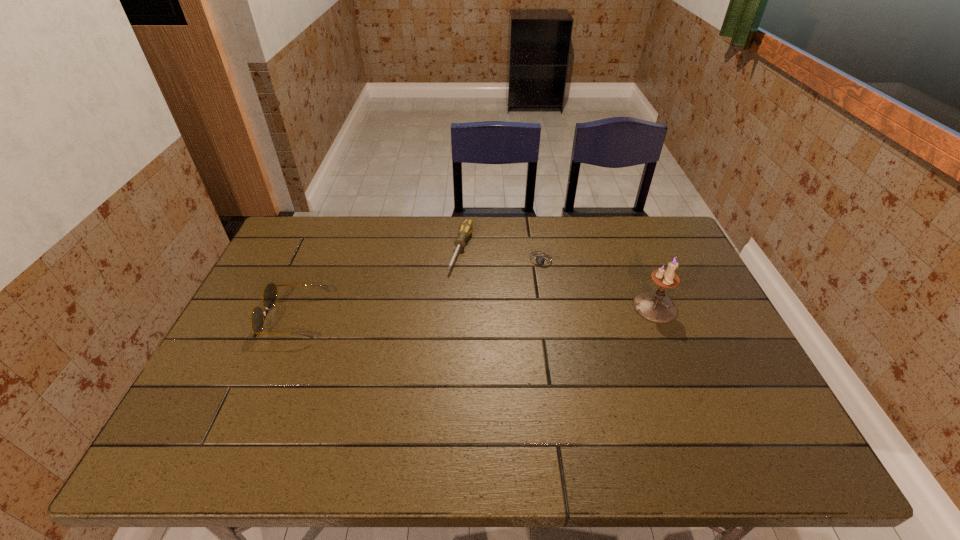
You are a GUI agent. You are given a task and a screenshot of the screen. Output one action in this format:
    pyautogui.click(x=<x>, y=<y>)
    Task: Click on the free space located 0.300m at the tip of the third object from right to left
    
    Given the screenshot: What is the action you would take?
    pyautogui.click(x=428, y=349)

This screenshot has width=960, height=540. Find the location of `vacant space situated 0.100m at the tip of the third object from right to left`. vacant space situated 0.100m at the tip of the third object from right to left is located at coordinates (449, 296).

Identify the location of vacant area situated 0.240m on the face of the shortest object. (503, 323).

Where is `vacant space located 0.330m on the face of the shortest object`? Image resolution: width=960 pixels, height=540 pixels. vacant space located 0.330m on the face of the shortest object is located at coordinates (489, 347).

Locate an element on the screen. free region located 0.240m on the face of the shortest object is located at coordinates (503, 323).

Image resolution: width=960 pixels, height=540 pixels. I want to click on screwdriver at the far edge, so click(x=466, y=228).

Where is `watch at the far edge`? watch at the far edge is located at coordinates (540, 260).

The image size is (960, 540). I want to click on object situated at the left edge, so click(270, 291).

Where is `object located at the right edge`? The image size is (960, 540). object located at the right edge is located at coordinates (653, 306).

The width and height of the screenshot is (960, 540). Identify the location of vacant space at the far edge of the desktop. (623, 229).